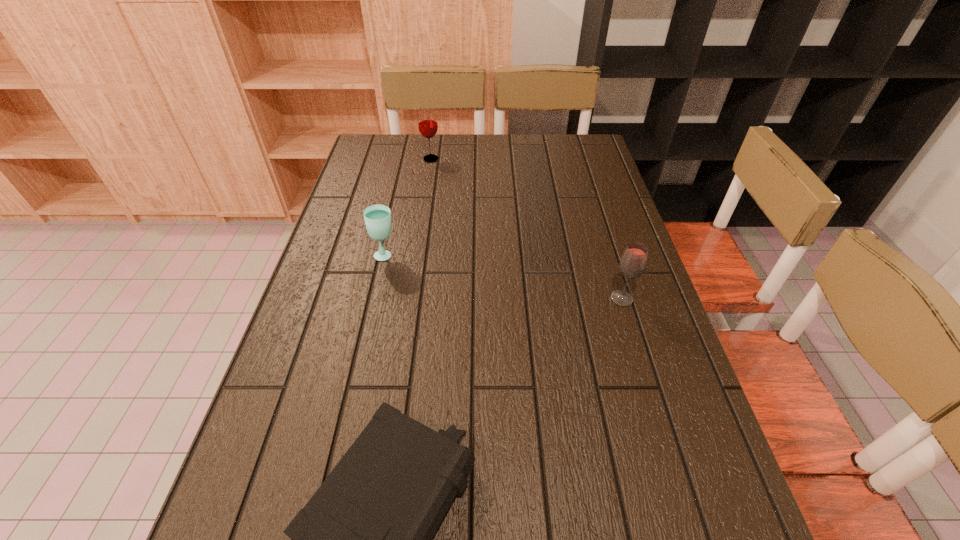
Find the location of a particular element. This screenshot has height=540, width=960. the second glass from right to left is located at coordinates (427, 121).

What are the coordinates of `the farthest object` in the screenshot? It's located at (427, 121).

This screenshot has width=960, height=540. Find the location of `the third farthest object`. the third farthest object is located at coordinates (633, 262).

Locate an element on the screen. The height and width of the screenshot is (540, 960). the rightmost object is located at coordinates (633, 262).

Identify the location of the second farthest object. The width and height of the screenshot is (960, 540). (377, 217).

You are a GUI agent. You are given a task and a screenshot of the screen. Output one action in this format:
    pyautogui.click(x=<x>, y=<y>)
    Task: Click on the leftmost glass
    
    Given the screenshot: What is the action you would take?
    pyautogui.click(x=377, y=217)

What are the coordinates of `vacant space located 0.330m on the front of the second glass from right to left` in the screenshot? It's located at (421, 224).

Find the location of a particular element. free space located 0.090m on the front of the second nearest object is located at coordinates coord(634,338).

I want to click on vacant area situated on the right of the leftmost glass, so click(501, 254).

Where is `object that is at the far edge`? The image size is (960, 540). object that is at the far edge is located at coordinates (427, 121).